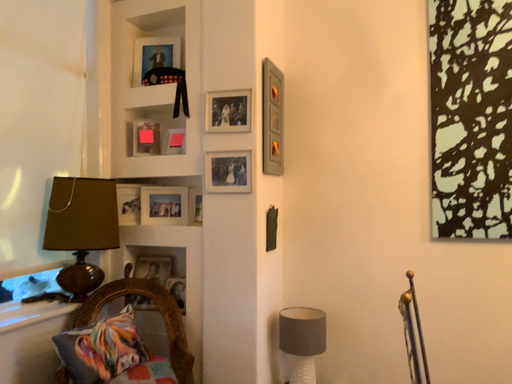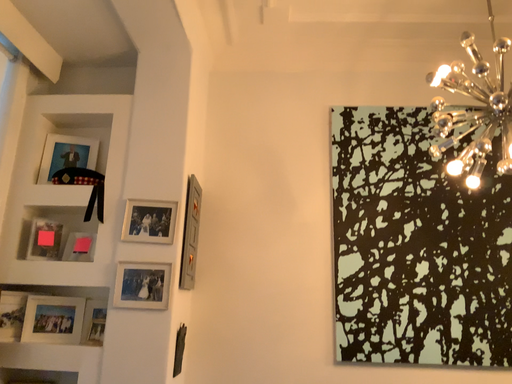
Question: Which way did the camera rotate in the video?

Choices:
 (A) rotated left
 (B) rotated right

Answer: (B)